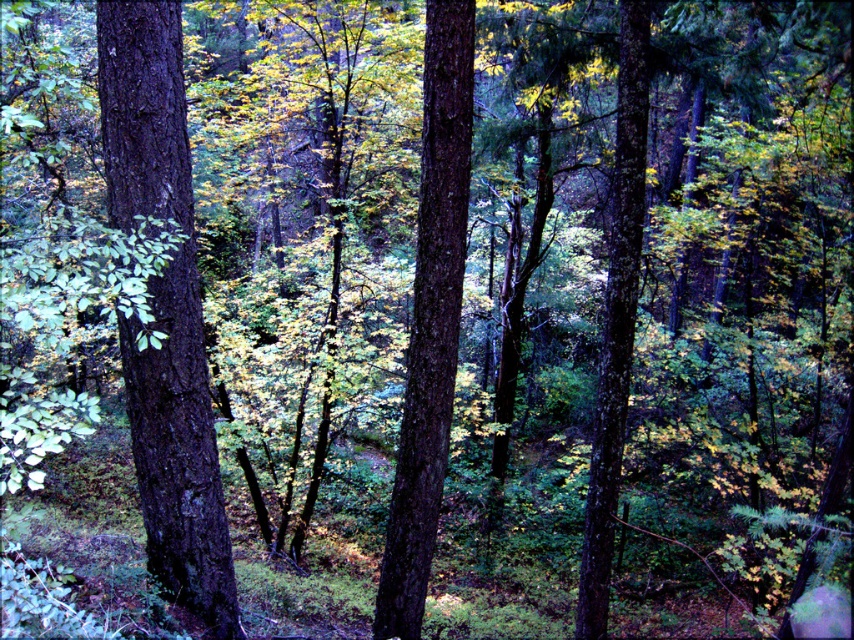
Question: Can you confirm if smooth dark brown tree trunk at left is positioned below smooth bark tree at center?

Choices:
 (A) no
 (B) yes

Answer: (B)

Question: Among these objects, which one is nearest to the camera?

Choices:
 (A) smooth bark tree at center
 (B) smooth dark brown tree trunk at left

Answer: (B)

Question: Is smooth dark brown tree trunk at left above smooth bark tree at center?

Choices:
 (A) yes
 (B) no

Answer: (B)

Question: Which of the following is the farthest from the observer?

Choices:
 (A) (148, 120)
 (B) (428, 312)

Answer: (B)

Question: Is smooth dark brown tree trunk at left thinner than smooth bark tree at center?

Choices:
 (A) no
 (B) yes

Answer: (B)